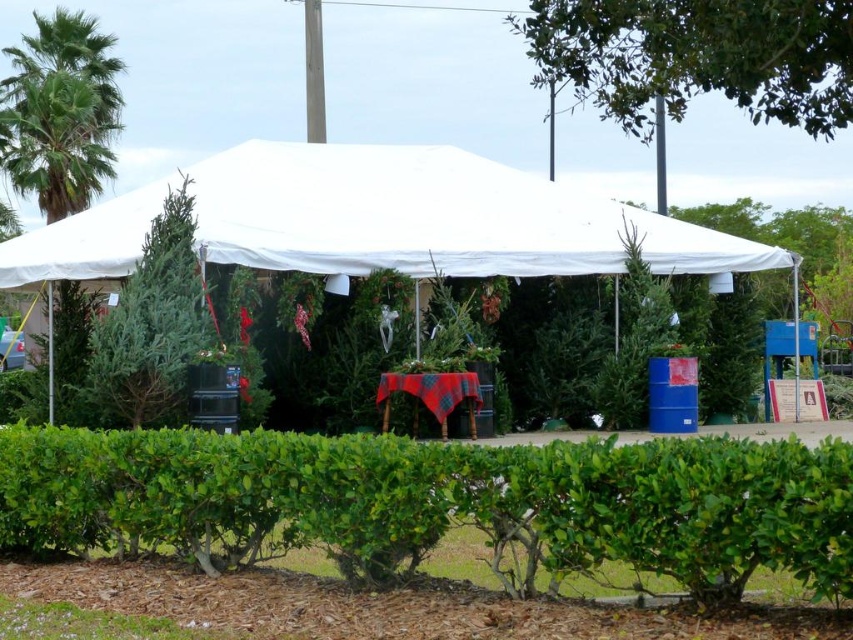
You are standing at the entrance of the tent and want to walk towards the point labeled point (575,61). Which direction should you go relative to the point labeled point (76,49)?

You should walk towards the point labeled point (575,61), which is in front of the point labeled point (76,49).

You are standing at the entrance of the tent and want to take a photo of the green leafy tree at upper center. Which direction should you face to capture it in your shot?

The green leafy tree at upper center is located at point (698, 56), so you should face towards the upper center direction to capture it in your photo.

You are standing outside the tent and want to place a new decoration between the green leafy hedge at center and the black plastic pole at upper right. Based on their positions, where should you place the decoration?

The green leafy hedge at center is below the black plastic pole at upper right, so you should place the decoration between them along the vertical axis, positioning it somewhere between the lower hedge and the higher pole.